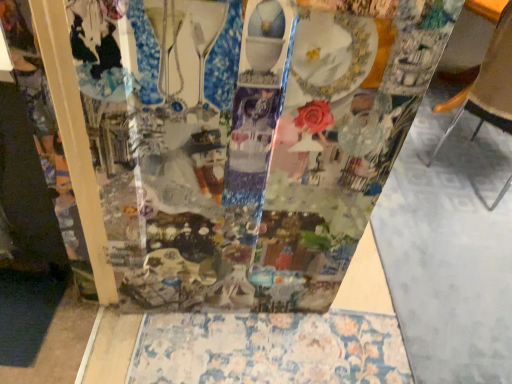
Question: Considering the relative sizes of floral-patterned fabric at lower center and brown leather chair at right in the image provided, is floral-patterned fabric at lower center taller than brown leather chair at right?

Choices:
 (A) yes
 (B) no

Answer: (B)

Question: Is floral-patterned fabric at lower center directly adjacent to brown leather chair at right?

Choices:
 (A) yes
 (B) no

Answer: (B)

Question: Is there a large distance between floral-patterned fabric at lower center and brown leather chair at right?

Choices:
 (A) yes
 (B) no

Answer: (A)

Question: From a real-world perspective, is floral-patterned fabric at lower center positioned over brown leather chair at right based on gravity?

Choices:
 (A) yes
 (B) no

Answer: (B)

Question: Considering the relative sizes of floral-patterned fabric at lower center and brown leather chair at right in the image provided, is floral-patterned fabric at lower center smaller than brown leather chair at right?

Choices:
 (A) no
 (B) yes

Answer: (B)

Question: Is floral-patterned fabric at lower center oriented towards brown leather chair at right?

Choices:
 (A) yes
 (B) no

Answer: (B)

Question: Can you confirm if brown leather chair at right is smaller than transparent plastic collage at center?

Choices:
 (A) no
 (B) yes

Answer: (A)

Question: From a real-world perspective, is brown leather chair at right positioned under transparent plastic collage at center based on gravity?

Choices:
 (A) yes
 (B) no

Answer: (A)

Question: Is brown leather chair at right oriented away from transparent plastic collage at center?

Choices:
 (A) no
 (B) yes

Answer: (A)

Question: Can you confirm if brown leather chair at right is thinner than transparent plastic collage at center?

Choices:
 (A) no
 (B) yes

Answer: (A)

Question: Does brown leather chair at right lie behind transparent plastic collage at center?

Choices:
 (A) no
 (B) yes

Answer: (B)

Question: From the image's perspective, is brown leather chair at right over transparent plastic collage at center?

Choices:
 (A) no
 (B) yes

Answer: (B)

Question: Is floral-patterned fabric at lower center positioned in front of transparent plastic collage at center?

Choices:
 (A) no
 (B) yes

Answer: (A)